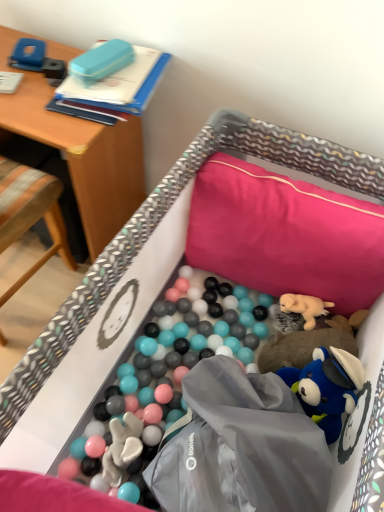
Question: From the image's perspective, is wooden chair at left below pink fabric pillow at upper right?

Choices:
 (A) yes
 (B) no

Answer: (B)

Question: Considering the relative sizes of wooden chair at left and pink fabric pillow at upper right in the image provided, is wooden chair at left taller than pink fabric pillow at upper right?

Choices:
 (A) yes
 (B) no

Answer: (A)

Question: Is wooden chair at left further to the viewer compared to pink fabric pillow at upper right?

Choices:
 (A) no
 (B) yes

Answer: (A)

Question: From the image's perspective, would you say wooden chair at left is positioned over pink fabric pillow at upper right?

Choices:
 (A) yes
 (B) no

Answer: (A)

Question: Could pink fabric pillow at upper right be considered to be inside wooden chair at left?

Choices:
 (A) no
 (B) yes

Answer: (A)

Question: Is wooden chair at left positioned beyond the bounds of pink fabric pillow at upper right?

Choices:
 (A) no
 (B) yes

Answer: (B)

Question: Does soft plush dog at center-right have a lesser height compared to pink fabric pillow at upper right?

Choices:
 (A) no
 (B) yes

Answer: (B)

Question: Considering the relative positions of soft plush dog at center-right and pink fabric pillow at upper right in the image provided, is soft plush dog at center-right to the left of pink fabric pillow at upper right from the viewer's perspective?

Choices:
 (A) no
 (B) yes

Answer: (A)

Question: Does soft plush dog at center-right appear on the right side of pink fabric pillow at upper right?

Choices:
 (A) no
 (B) yes

Answer: (B)

Question: Is pink fabric pillow at upper right at the back of soft plush dog at center-right?

Choices:
 (A) yes
 (B) no

Answer: (B)

Question: From a real-world perspective, is soft plush dog at center-right on top of pink fabric pillow at upper right?

Choices:
 (A) yes
 (B) no

Answer: (B)

Question: Is soft plush dog at center-right far away from pink fabric pillow at upper right?

Choices:
 (A) no
 (B) yes

Answer: (A)

Question: From a real-world perspective, is pink fabric pillow at upper right physically above wooden chair at left?

Choices:
 (A) yes
 (B) no

Answer: (B)